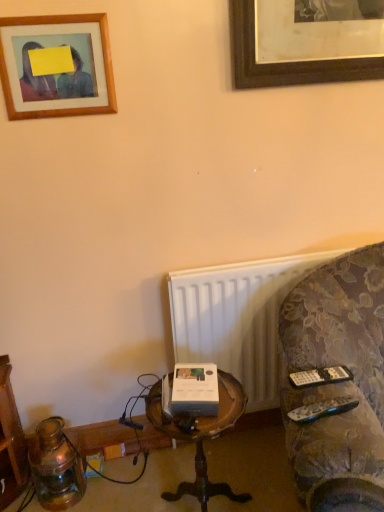
Locate an element on the screen. free space above white plastic radiator at lower right (from a real-world perspective) is located at coordinates (248, 265).